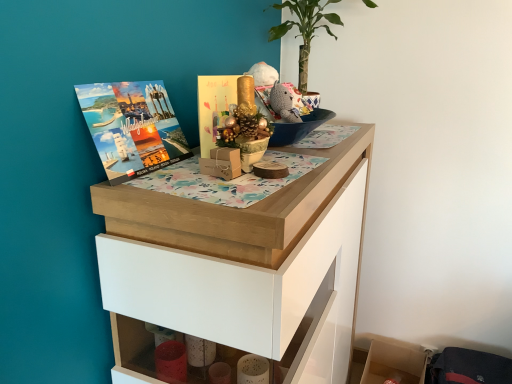
Question: Considering the relative positions of wooden shelf at lower right and wooden chest of drawers at upper center in the image provided, is wooden shelf at lower right to the left or to the right of wooden chest of drawers at upper center?

Choices:
 (A) right
 (B) left

Answer: (A)

Question: From a real-world perspective, is wooden shelf at lower right above or below wooden chest of drawers at upper center?

Choices:
 (A) above
 (B) below

Answer: (B)

Question: Based on their relative distances, which object is nearer to the matte paper book cover at upper left, the 2th book cover in the right-to-left sequence?

Choices:
 (A) gold paper card at center, which is counted as the second book cover, starting from the left
 (B) wooden shelf at lower right
 (C) green leafy plant at upper center
 (D) wooden chest of drawers at upper center

Answer: (A)

Question: Which object is the farthest from the wooden chest of drawers at upper center?

Choices:
 (A) matte paper book cover at upper left, the 2th book cover in the right-to-left sequence
 (B) green leafy plant at upper center
 (C) gold paper card at center, the 1th book cover viewed from the right
 (D) wooden shelf at lower right

Answer: (D)